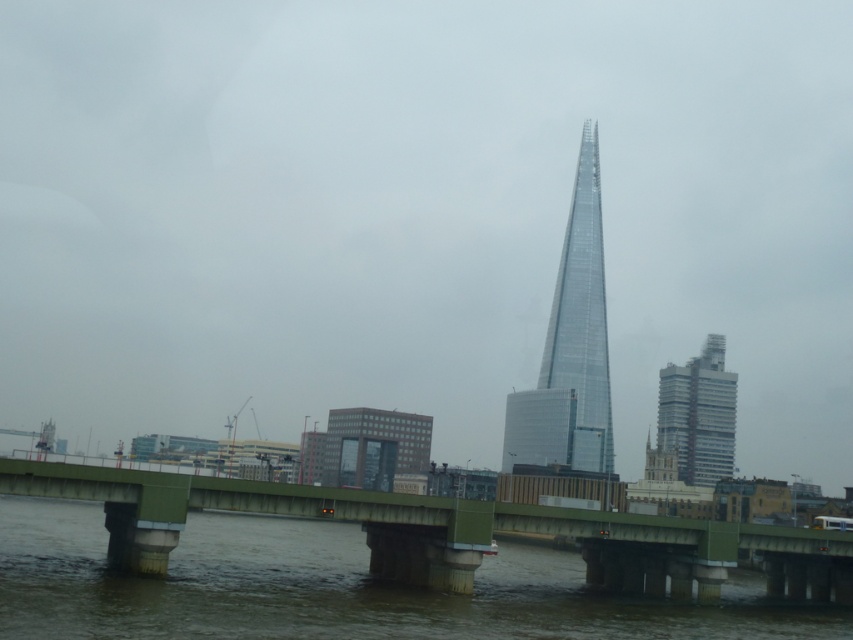
Question: Estimate the real-world distances between objects in this image. Which object is closer to the green concrete bridge at center?

Choices:
 (A) transparent glass tower at center
 (B) glassy steel skyscraper at right

Answer: (B)

Question: Considering the real-world distances, which object is farthest from the glassy steel skyscraper at right?

Choices:
 (A) transparent glass tower at center
 (B) green concrete bridge at center

Answer: (B)

Question: Is green concrete bridge at center thinner than glassy steel skyscraper at right?

Choices:
 (A) yes
 (B) no

Answer: (A)

Question: Which point is farther to the camera?

Choices:
 (A) (630, 534)
 (B) (669, 404)

Answer: (B)

Question: Does green concrete bridge at center have a larger size compared to glassy steel skyscraper at right?

Choices:
 (A) yes
 (B) no

Answer: (B)

Question: Is green concrete bridge at center to the right of glassy steel skyscraper at right from the viewer's perspective?

Choices:
 (A) yes
 (B) no

Answer: (B)